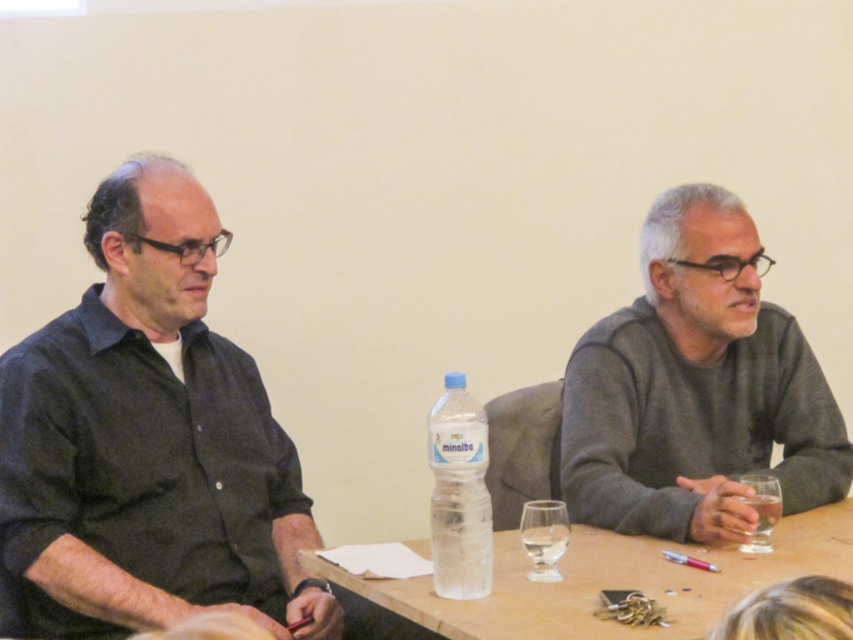
Between black matte shirt at left and clear plastic bottle at center, which one appears on the left side from the viewer's perspective?

black matte shirt at left is more to the left.

The height and width of the screenshot is (640, 853). What do you see at coordinates (149, 436) in the screenshot?
I see `black matte shirt at left` at bounding box center [149, 436].

You are a GUI agent. You are given a task and a screenshot of the screen. Output one action in this format:
    pyautogui.click(x=<x>, y=<y>)
    Task: Click on the black matte shirt at left
    This screenshot has height=640, width=853.
    Given the screenshot: What is the action you would take?
    pyautogui.click(x=149, y=436)

Is clear plastic table at center below clear plastic bottle at center?

Yes.

Which is behind, point (657, 577) or point (485, 426)?

Point (657, 577)

Find the location of a particular element. The height and width of the screenshot is (640, 853). clear plastic table at center is located at coordinates (611, 580).

Is gray sweater at right above clear plastic bottle at center?

Yes.

Does gray sweater at right have a larger size compared to clear plastic bottle at center?

Correct, gray sweater at right is larger in size than clear plastic bottle at center.

Between point (659, 358) and point (445, 512), which one is positioned behind?

The point (659, 358) is more distant.

This screenshot has width=853, height=640. Find the location of `gray sweater at right`. gray sweater at right is located at coordinates (695, 387).